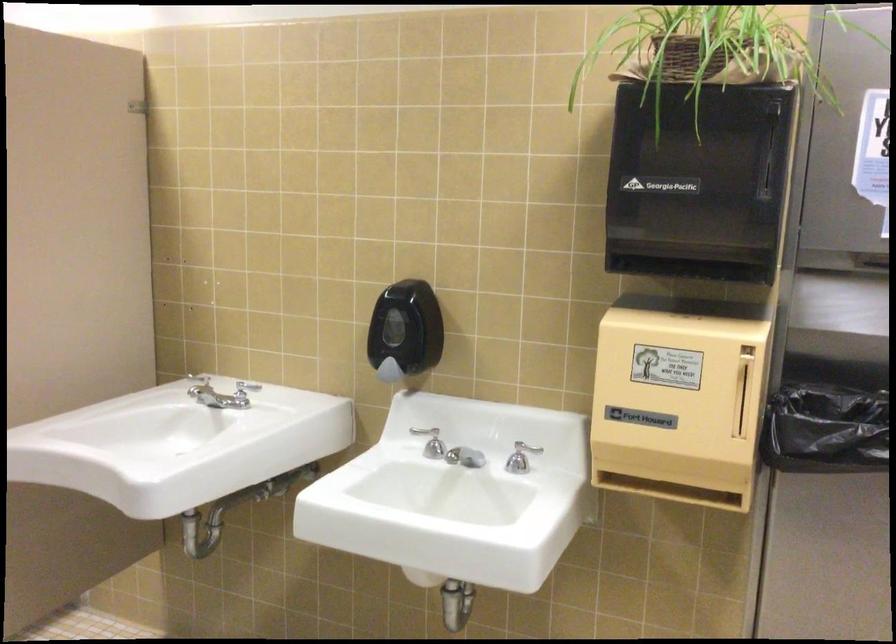
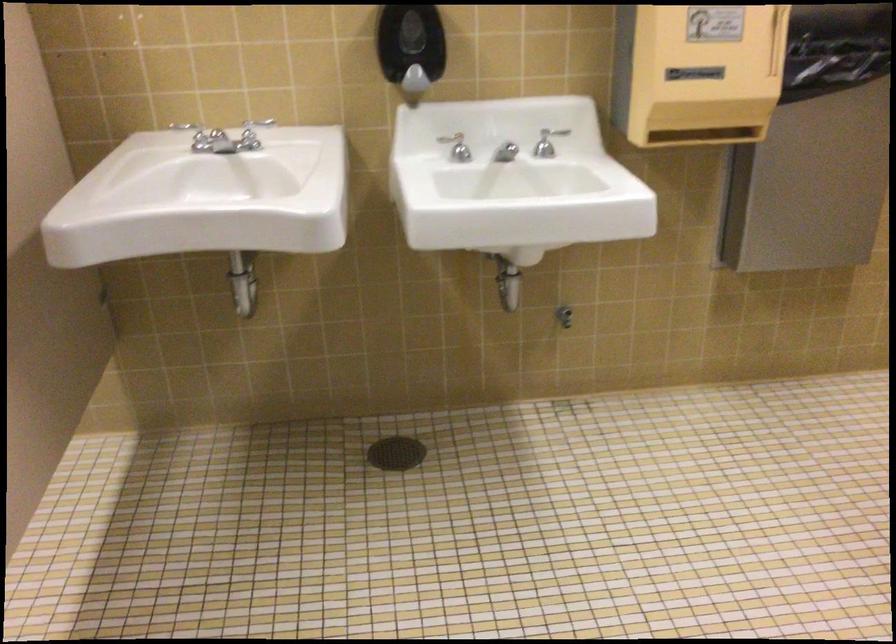
In the second image, find the point that corresponds to point (244, 382) in the first image.

(194, 135)